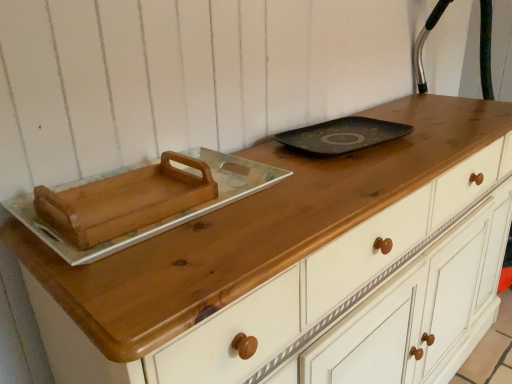
Where is `vacant space to the right of black matte tray at center`? Image resolution: width=512 pixels, height=384 pixels. vacant space to the right of black matte tray at center is located at coordinates (438, 135).